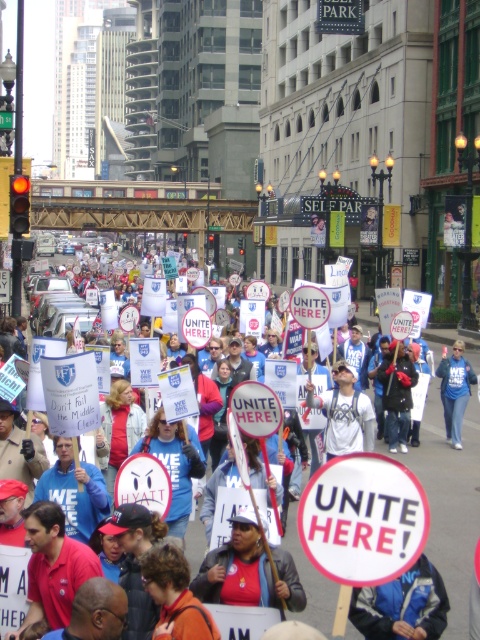
Can you confirm if white paper sign at center is smaller than blue fabric sign at center?

No, white paper sign at center is not smaller than blue fabric sign at center.

Does white paper sign at center have a greater height compared to blue fabric sign at center?

Yes, white paper sign at center is taller than blue fabric sign at center.

Does point (462, 570) come closer to viewer compared to point (458, 401)?

Yes, it is.

The width and height of the screenshot is (480, 640). Find the location of `white paper sign at center`. white paper sign at center is located at coordinates point(450,500).